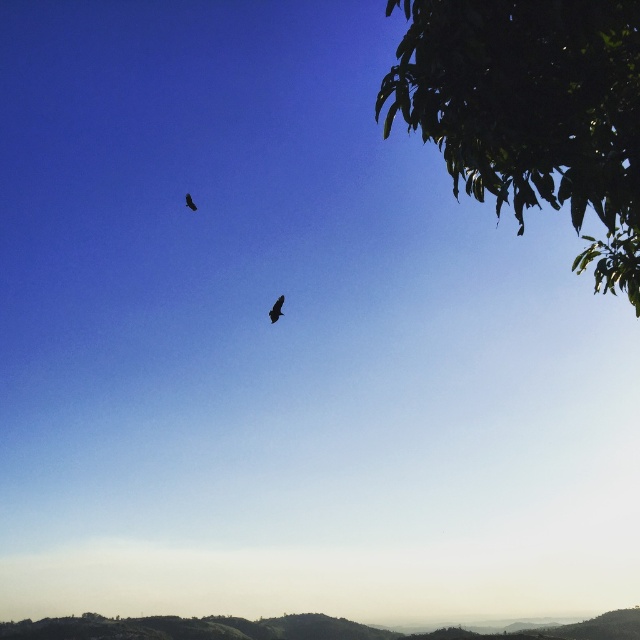
You are an ornithologist observing two birds in the sky. You notice a green leafy tree at upper right. How far apart are the two birds from each other?

The two birds are 4.13 meters apart.

You are an ornithologist observing the scene. You notice the green leafy tree at upper right and the dark brown feathered bird at upper center. Which object is closer to the observer?

The green leafy tree at upper right is closer to the observer because it is positioned in front of the dark brown feathered bird at upper center.